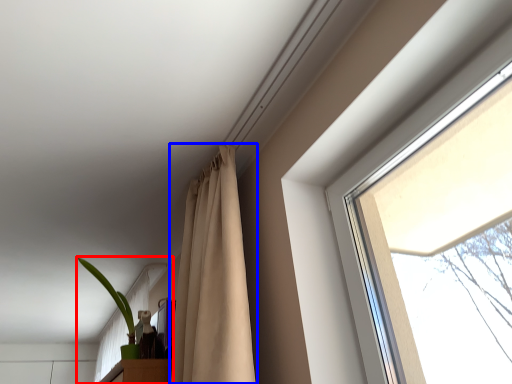
Question: Which object is further to the camera taking this photo, houseplant (highlighted by a red box) or curtain (highlighted by a blue box)?

Choices:
 (A) houseplant
 (B) curtain

Answer: (A)